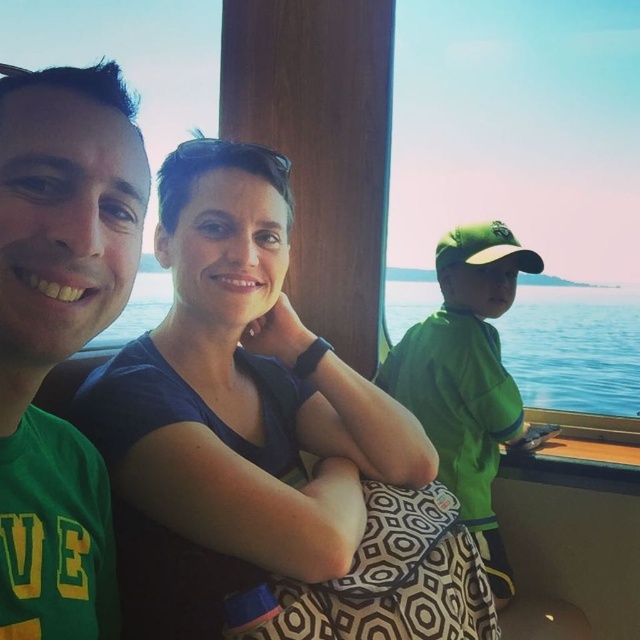
Who is lower down, green matte t-shirt at left or blue water at center?

green matte t-shirt at left is lower down.

Consider the image. Is green matte t-shirt at left to the left of blue water at center from the viewer's perspective?

Yes, green matte t-shirt at left is to the left of blue water at center.

Does point (108, 513) come closer to viewer compared to point (112, 330)?

Yes, it is.

Locate an element on the screen. green matte t-shirt at left is located at coordinates (60, 333).

Does matte blue shirt at center have a lesser height compared to green matte t-shirt at left?

In fact, matte blue shirt at center may be taller than green matte t-shirt at left.

What do you see at coordinates (234, 408) in the screenshot? Image resolution: width=640 pixels, height=640 pixels. I see `matte blue shirt at center` at bounding box center [234, 408].

Does point (164, 406) lie in front of point (93, 218)?

No, (164, 406) is behind (93, 218).

Find the location of a particular element. The height and width of the screenshot is (640, 640). matte blue shirt at center is located at coordinates (234, 408).

Between matte blue shirt at center and blue water at center, which one appears on the left side from the viewer's perspective?

matte blue shirt at center is more to the left.

Who is shorter, matte blue shirt at center or blue water at center?

With less height is blue water at center.

Does point (332, 572) come behind point (416, 300)?

That is False.

The width and height of the screenshot is (640, 640). I want to click on matte blue shirt at center, so point(234,408).